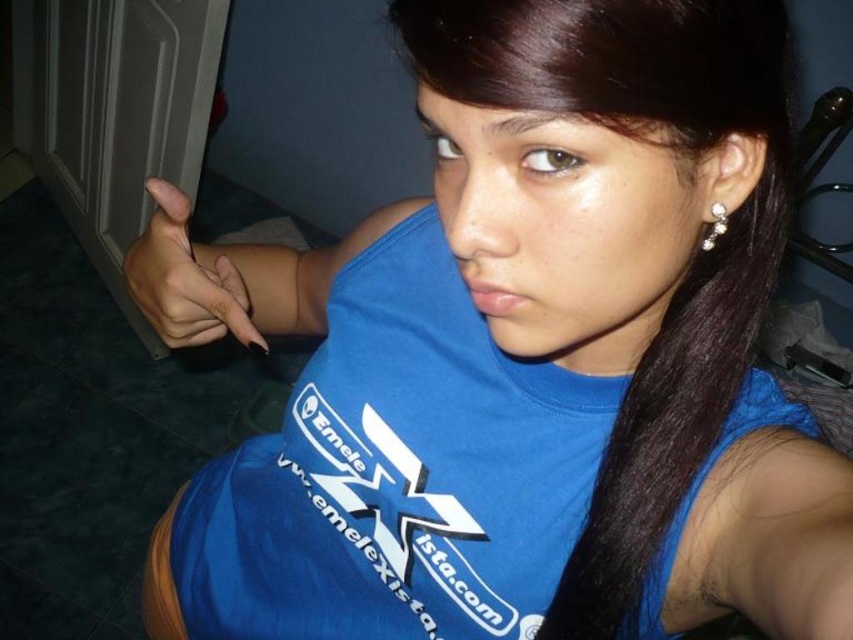
Which is in front, point (142, 259) or point (705, 234)?

Point (705, 234) is in front.

Does nail polish at center have a greater height compared to pearl shiny earrings at upper right?

Indeed, nail polish at center has a greater height compared to pearl shiny earrings at upper right.

Where is `nail polish at center`? Image resolution: width=853 pixels, height=640 pixels. nail polish at center is located at coordinates (184, 280).